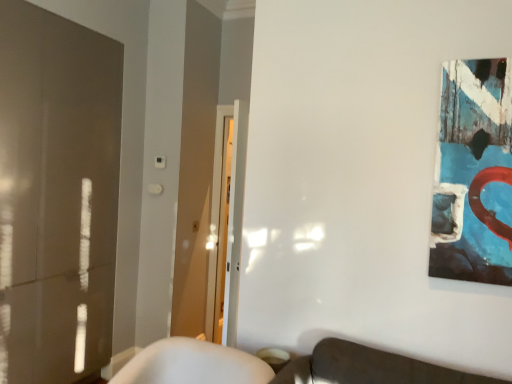
Question: From the image's perspective, is matte glass door at left located above or below textured canvas artwork at upper right?

Choices:
 (A) below
 (B) above

Answer: (A)

Question: Is matte glass door at left inside or outside of textured canvas artwork at upper right?

Choices:
 (A) outside
 (B) inside

Answer: (A)

Question: Considering their positions, is matte glass door at left located in front of or behind textured canvas artwork at upper right?

Choices:
 (A) front
 (B) behind

Answer: (B)

Question: Would you say textured canvas artwork at upper right is inside or outside matte glass door at left?

Choices:
 (A) outside
 (B) inside

Answer: (A)

Question: From a real-world perspective, is textured canvas artwork at upper right positioned above or below matte glass door at left?

Choices:
 (A) above
 (B) below

Answer: (A)

Question: From their relative heights in the image, would you say textured canvas artwork at upper right is taller or shorter than matte glass door at left?

Choices:
 (A) tall
 (B) short

Answer: (B)

Question: Considering the positions of point (478, 77) and point (10, 205), is point (478, 77) closer or farther from the camera than point (10, 205)?

Choices:
 (A) closer
 (B) farther

Answer: (A)